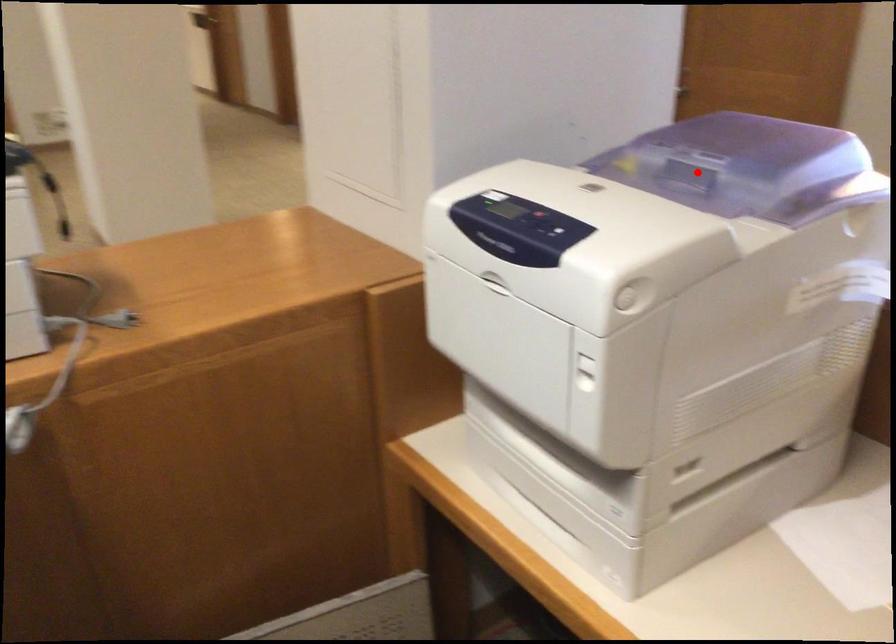
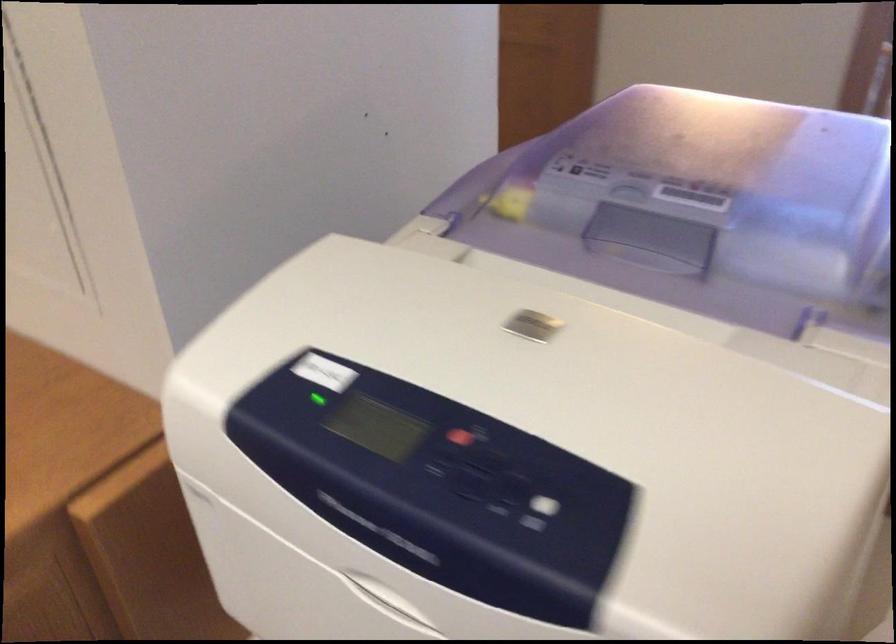
Question: I am providing you with two images of the same scene from different viewpoints. In image1, a red point is highlighted. Considering the same 3D point in image2, which of the following is correct?

Choices:
 (A) It is closer
 (B) It is farther

Answer: (A)